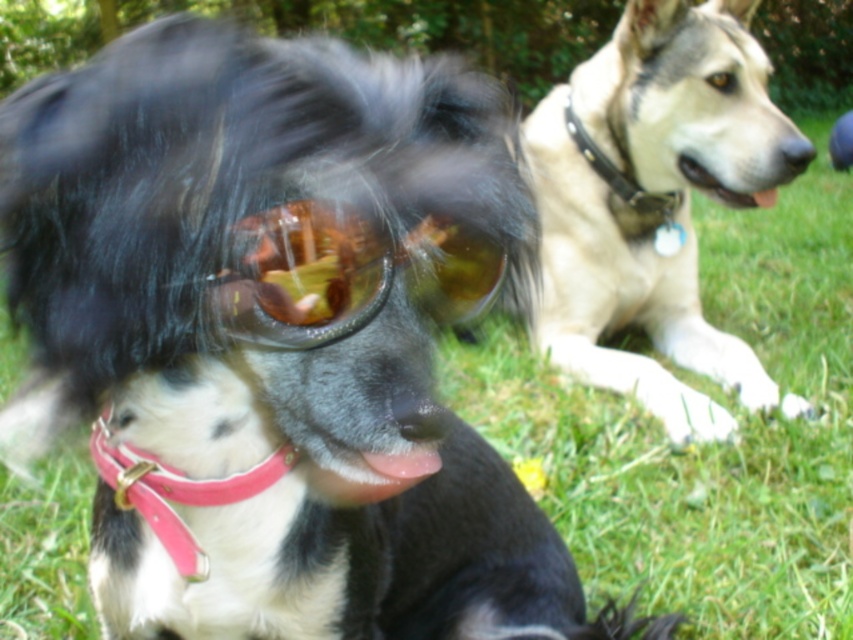
Question: Among these objects, which one is nearest to the camera?

Choices:
 (A) pink leather collar at lower left
 (B) shiny plastic goggles at center
 (C) black leather collar at upper right

Answer: (B)

Question: Can you confirm if light brown fur at upper right is smaller than pink leather collar at lower left?

Choices:
 (A) yes
 (B) no

Answer: (B)

Question: Does light brown fur at upper right appear on the right side of black leather collar at upper right?

Choices:
 (A) yes
 (B) no

Answer: (A)

Question: Is the position of shiny plastic goggles at center more distant than that of black leather collar at upper right?

Choices:
 (A) no
 (B) yes

Answer: (A)

Question: Which point is farther to the camera?

Choices:
 (A) (683, 241)
 (B) (312, 257)
 (C) (722, 74)
 (D) (210, 488)

Answer: (A)

Question: Which of the following is the closest to the observer?

Choices:
 (A) (631, 384)
 (B) (198, 545)

Answer: (B)